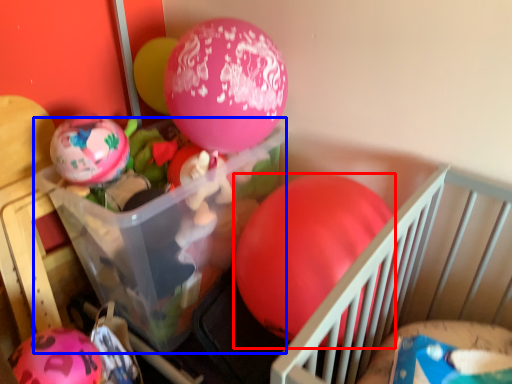
Question: Among these objects, which one is nearest to the camera, balloon (highlighted by a red box) or storage box (highlighted by a blue box)?

Choices:
 (A) balloon
 (B) storage box

Answer: (A)